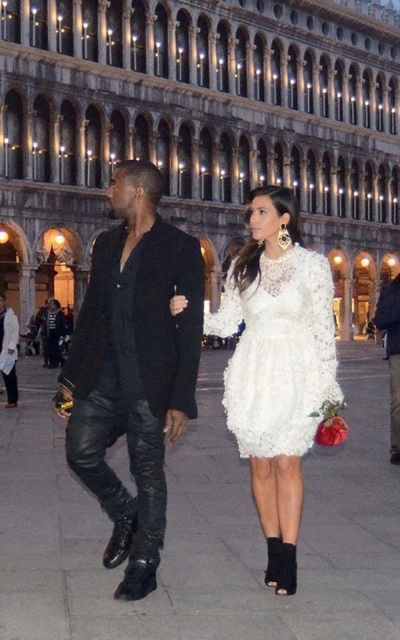
Looking at this image, you are a photographer aiming to capture a detailed shot of both the white lace dress at center and the black leather pants at lower left. Since you want to ensure both are clearly visible, which object should you focus on first to avoid blurring due to their size difference?

The white lace dress at center is smaller than the black leather pants at lower left, so you should focus on the white lace dress at center first to ensure its details are captured clearly before adjusting for the larger object.

You are standing at the point marked as point [133,369] in the image. What object are you currently standing on?

You are standing on the black leather pants at center.

You are a photographer aiming to capture the contrast between modern and traditional elements in the scene. The black leather pants at center and the white lace dress at center are key subjects. Which of these two items is positioned higher up in the image?

The black leather pants at center is above the white lace dress at center in the image.